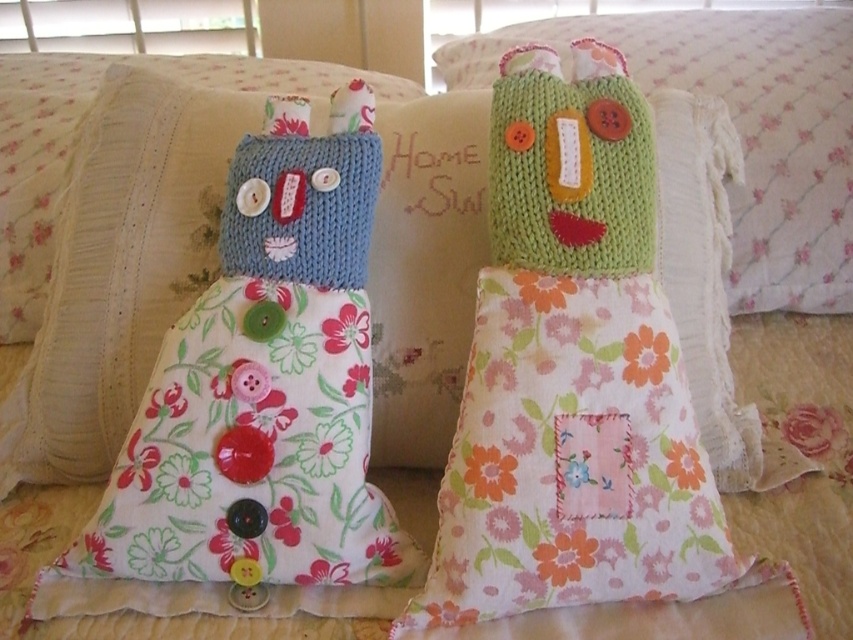
You are an interior designer arranging a cozy living room. You have two items to place on the sofa cushion. The items are the knitted green doll at center and the green knitted pillow at center. According to the image, which item is placed below the other?

The knitted green doll at center is positioned under the green knitted pillow at center, so the doll is below the pillow.

You are standing in front of the bed and want to reach the knitted green doll at center and the green knitted pillow at center. Which one can you touch first without moving your hand?

The knitted green doll at center is closer to the viewer than the green knitted pillow at center, so you can touch the knitted green doll at center first without moving your hand.